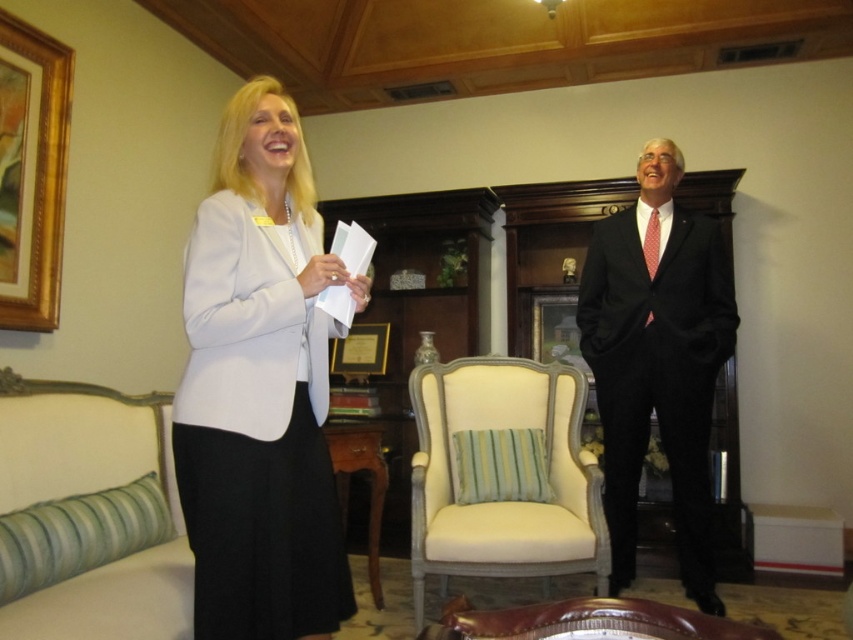
Question: Among these points, which one is farthest from the camera?

Choices:
 (A) (548, 541)
 (B) (648, 380)

Answer: (B)

Question: Which object appears closest to the camera in this image?

Choices:
 (A) gold-framed painting at upper left
 (B) black suit at right
 (C) green striped fabric armchair at lower left
 (D) white matte blazer at center

Answer: (C)

Question: Is cream fabric armchair at center smaller than gold-framed painting at upper left?

Choices:
 (A) yes
 (B) no

Answer: (B)

Question: Where is white matte blazer at center located in relation to gold-framed painting at upper left in the image?

Choices:
 (A) above
 (B) below

Answer: (B)

Question: Does cream fabric armchair at center appear on the left side of leather armchair at center?

Choices:
 (A) no
 (B) yes

Answer: (A)

Question: Which object appears farthest from the camera in this image?

Choices:
 (A) gold-framed painting at upper left
 (B) cream fabric armchair at center
 (C) green striped fabric armchair at lower left
 (D) black suit at right

Answer: (D)